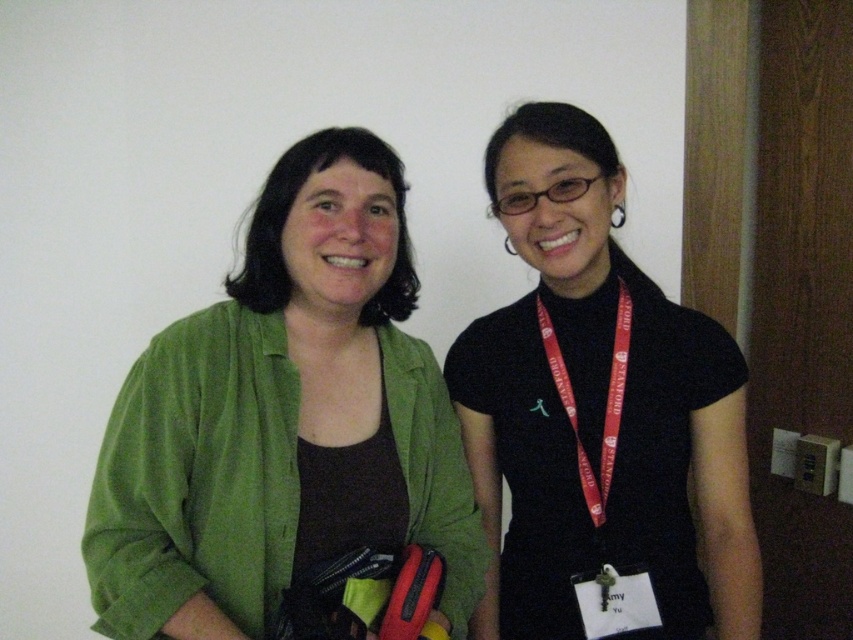
Question: Which object is the farthest from the black fabric neck at center?

Choices:
 (A) black matte dress at center
 (B) matte green neck at center

Answer: (B)

Question: Can you confirm if black matte dress at center is smaller than red fabric lanyard at center?

Choices:
 (A) yes
 (B) no

Answer: (B)

Question: Which of these objects is positioned closest to the green cotton shirt at center?

Choices:
 (A) red fabric lanyard at center
 (B) matte green neck at center

Answer: (B)

Question: Which object is farther from the camera taking this photo?

Choices:
 (A) black matte dress at center
 (B) black fabric neck at center
 (C) red fabric lanyard at center
 (D) matte green neck at center

Answer: (C)

Question: Does black matte dress at center have a lesser width compared to red fabric lanyard at center?

Choices:
 (A) no
 (B) yes

Answer: (A)

Question: In this image, where is green cotton shirt at center located relative to red fabric lanyard at center?

Choices:
 (A) above
 (B) below

Answer: (A)